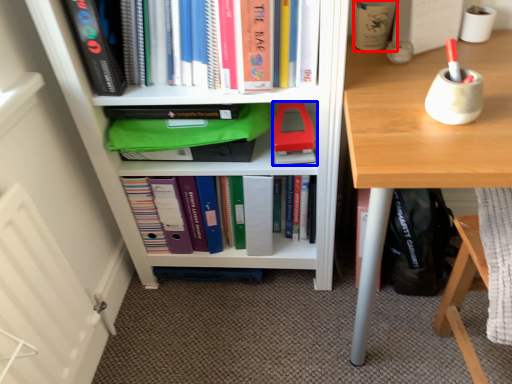
Question: Among these objects, which one is nearest to the camera, stationery (highlighted by a red box) or paperback book (highlighted by a blue box)?

Choices:
 (A) stationery
 (B) paperback book

Answer: (A)